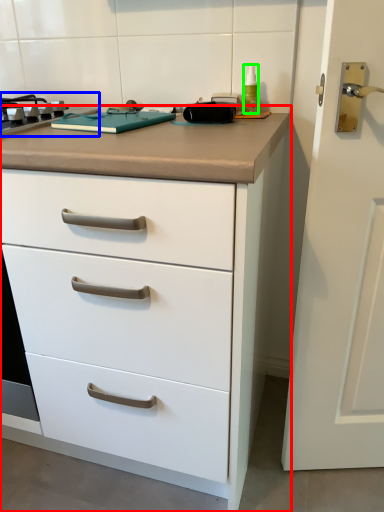
Question: Considering the real-world distances, which object is farthest from chest of drawers (highlighted by a red box)? gas stove (highlighted by a blue box) or bottle (highlighted by a green box)?

Choices:
 (A) gas stove
 (B) bottle

Answer: (B)